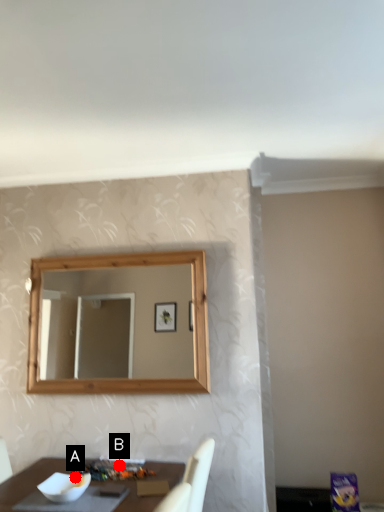
Question: Two points are circled on the image, labeled by A and B beside each circle. Among these points, which one is nearest to the camera?

Choices:
 (A) A is closer
 (B) B is closer

Answer: (A)